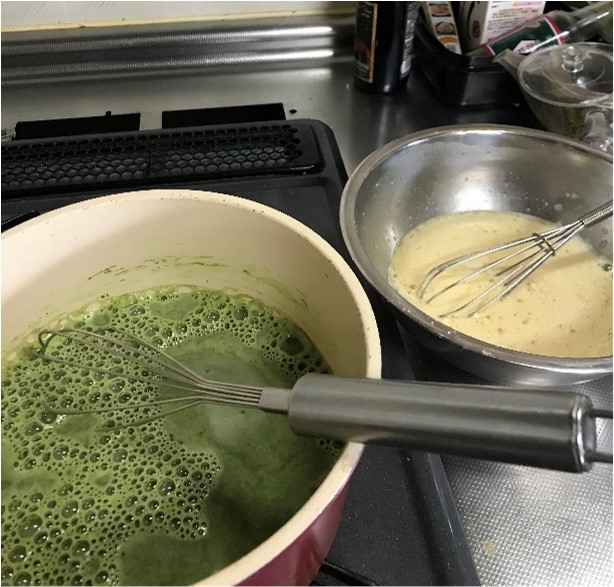
Where is `bowl sides`? The image size is (614, 587). bowl sides is located at coordinates (301, 570), (479, 374).